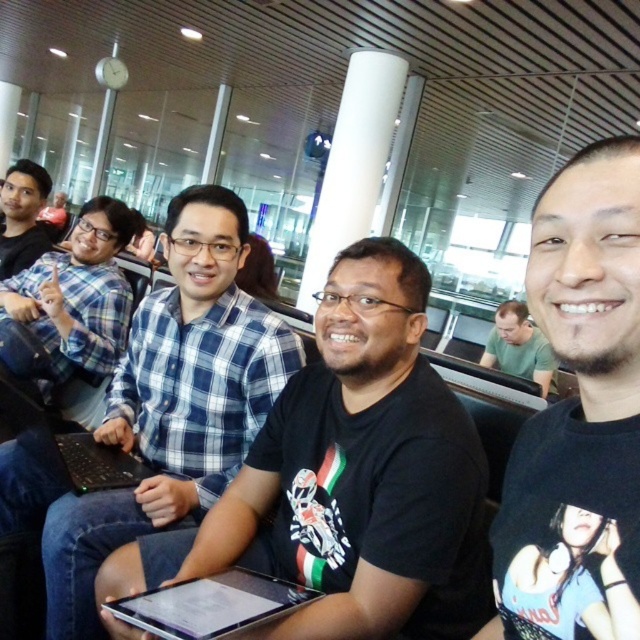
Which is more to the left, silver metallic tablet at center or matte black shirt at left?

matte black shirt at left is more to the left.

This screenshot has height=640, width=640. Describe the element at coordinates (211, 604) in the screenshot. I see `silver metallic tablet at center` at that location.

Who is more distant from viewer, [118,605] or [24,209]?

The point [24,209] is behind.

The image size is (640, 640). I want to click on silver metallic tablet at center, so click(211, 604).

Between point (602, 531) and point (3, 186), which one is positioned in front?

Point (602, 531) is in front.

Does black matte t-shirt at center have a lesser height compared to matte black shirt at left?

No.

Does point (560, 179) come behind point (17, 272)?

No, (560, 179) is in front of (17, 272).

Where is `black matte t-shirt at center`? black matte t-shirt at center is located at coordinates (579, 413).

Which is more to the right, black matte shirt at center or matte black shirt at left?

black matte shirt at center

Which is below, black matte shirt at center or matte black shirt at left?

black matte shirt at center

Who is more distant from viewer, (166, 545) or (6, 236)?

Point (6, 236)

You are a GUI agent. You are given a task and a screenshot of the screen. Output one action in this format:
    pyautogui.click(x=<x>, y=<y>)
    Task: Click on the black matte shirt at center
    
    Given the screenshot: What is the action you would take?
    pyautogui.click(x=348, y=480)